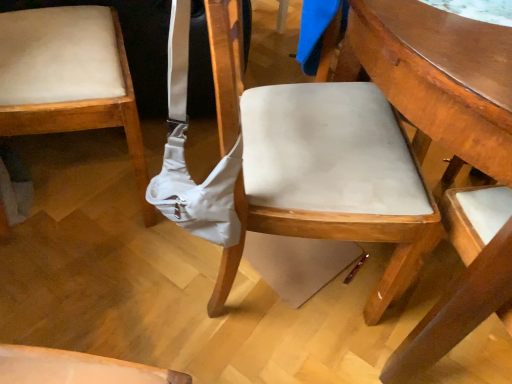
Question: Is matte beige cushion at left, the 2th chair when ordered from right to left, placed right next to wooden table at center?

Choices:
 (A) yes
 (B) no

Answer: (B)

Question: Is matte beige cushion at left, the 2th chair when ordered from right to left, outside wooden table at center?

Choices:
 (A) no
 (B) yes

Answer: (B)

Question: Is there a large distance between matte beige cushion at left, which is the 1th chair from left to right, and wooden table at center?

Choices:
 (A) yes
 (B) no

Answer: (B)

Question: Can you confirm if matte beige cushion at left, the 2th chair when ordered from right to left, is taller than wooden table at center?

Choices:
 (A) yes
 (B) no

Answer: (B)

Question: From the image's perspective, is matte beige cushion at left, which is the 1th chair from left to right, below wooden table at center?

Choices:
 (A) no
 (B) yes

Answer: (A)

Question: Would you say matte white chair at center, which is the first chair from right to left, is to the left or to the right of matte beige cushion at left, which is the 1th chair from left to right, in the picture?

Choices:
 (A) right
 (B) left

Answer: (A)

Question: Considering the positions of matte white chair at center, which is the first chair from right to left, and matte beige cushion at left, the 2th chair when ordered from right to left, in the image, is matte white chair at center, which is the first chair from right to left, wider or thinner than matte beige cushion at left, the 2th chair when ordered from right to left,?

Choices:
 (A) wide
 (B) thin

Answer: (A)

Question: From the image's perspective, is matte white chair at center, the 2th chair viewed from the left, above or below matte beige cushion at left, which is the 1th chair from left to right?

Choices:
 (A) above
 (B) below

Answer: (B)

Question: From a real-world perspective, relative to matte beige cushion at left, the 2th chair when ordered from right to left, is matte white chair at center, the 2th chair viewed from the left, vertically above or below?

Choices:
 (A) above
 (B) below

Answer: (A)

Question: Based on their positions, is wooden table at center located to the left or right of matte white chair at center, the 2th chair viewed from the left?

Choices:
 (A) right
 (B) left

Answer: (A)

Question: Is wooden table at center taller or shorter than matte white chair at center, which is the first chair from right to left?

Choices:
 (A) short
 (B) tall

Answer: (A)

Question: Is wooden table at center inside the boundaries of matte white chair at center, which is the first chair from right to left, or outside?

Choices:
 (A) inside
 (B) outside

Answer: (B)

Question: Relative to matte white chair at center, which is the first chair from right to left, is wooden table at center in front or behind?

Choices:
 (A) behind
 (B) front

Answer: (B)

Question: Is matte white chair at center, the 2th chair viewed from the left, to the left or to the right of white fabric shoulder bag at center in the image?

Choices:
 (A) right
 (B) left

Answer: (A)

Question: Considering the positions of matte white chair at center, the 2th chair viewed from the left, and white fabric shoulder bag at center in the image, is matte white chair at center, the 2th chair viewed from the left, taller or shorter than white fabric shoulder bag at center?

Choices:
 (A) tall
 (B) short

Answer: (A)